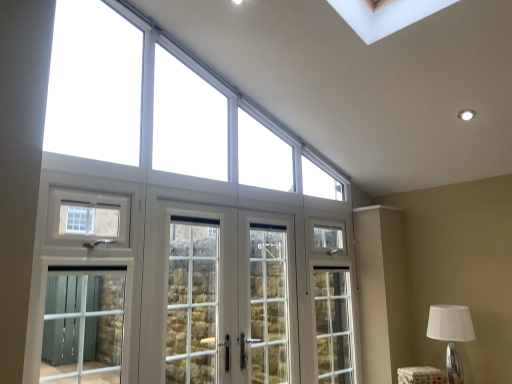
Question: Could you tell me if white glass doors at center, acting as the second screen door starting from the right, is facing clear glass door at center, which appears as the 3th screen door when viewed from the left?

Choices:
 (A) yes
 (B) no

Answer: (A)

Question: From a real-world perspective, is white glass doors at center, acting as the second screen door starting from the right, physically above clear glass door at center, which appears as the 3th screen door when viewed from the left?

Choices:
 (A) no
 (B) yes

Answer: (B)

Question: Can you confirm if white glass doors at center, which is counted as the 2th screen door, starting from the left, is positioned to the left of clear glass door at center, which appears as the 3th screen door when viewed from the left?

Choices:
 (A) no
 (B) yes

Answer: (B)

Question: Considering the relative positions of white glass doors at center, acting as the second screen door starting from the right, and clear glass door at center, the 1th screen door when ordered from right to left, in the image provided, is white glass doors at center, acting as the second screen door starting from the right, to the right of clear glass door at center, the 1th screen door when ordered from right to left, from the viewer's perspective?

Choices:
 (A) no
 (B) yes

Answer: (A)

Question: Is white glass doors at center, acting as the second screen door starting from the right, thinner than clear glass door at center, which appears as the 3th screen door when viewed from the left?

Choices:
 (A) yes
 (B) no

Answer: (B)

Question: Is white glass doors at center, which is counted as the 2th screen door, starting from the left, wider or thinner than white glass door at center, arranged as the first screen door when viewed from the left?

Choices:
 (A) thin
 (B) wide

Answer: (B)

Question: Considering the positions of point (250, 291) and point (181, 344), is point (250, 291) closer or farther from the camera than point (181, 344)?

Choices:
 (A) farther
 (B) closer

Answer: (A)

Question: Which is correct: white glass doors at center, acting as the second screen door starting from the right, is inside white glass door at center, marked as the 3th screen door in a right-to-left arrangement, or outside of it?

Choices:
 (A) inside
 (B) outside

Answer: (A)

Question: Looking at the image, does white glass doors at center, which is counted as the 2th screen door, starting from the left, seem bigger or smaller compared to white glass door at center, marked as the 3th screen door in a right-to-left arrangement?

Choices:
 (A) big
 (B) small

Answer: (A)

Question: Considering the positions of white glass doors at center, acting as the second screen door starting from the right, and white fabric lampshade at lower right in the image, is white glass doors at center, acting as the second screen door starting from the right, taller or shorter than white fabric lampshade at lower right?

Choices:
 (A) tall
 (B) short

Answer: (A)

Question: Is white glass doors at center, which is counted as the 2th screen door, starting from the left, situated inside white fabric lampshade at lower right or outside?

Choices:
 (A) inside
 (B) outside

Answer: (B)

Question: Considering the relative positions of white glass doors at center, which is counted as the 2th screen door, starting from the left, and white fabric lampshade at lower right in the image provided, is white glass doors at center, which is counted as the 2th screen door, starting from the left, to the left or to the right of white fabric lampshade at lower right?

Choices:
 (A) right
 (B) left

Answer: (B)

Question: Is white glass doors at center, which is counted as the 2th screen door, starting from the left, wider or thinner than white fabric lampshade at lower right?

Choices:
 (A) thin
 (B) wide

Answer: (A)

Question: Relative to white glass doors at center, which is counted as the 2th screen door, starting from the left, is white glass windows at upper center in front or behind?

Choices:
 (A) behind
 (B) front

Answer: (B)

Question: Considering the positions of point (329, 185) and point (179, 291), is point (329, 185) closer or farther from the camera than point (179, 291)?

Choices:
 (A) closer
 (B) farther

Answer: (B)